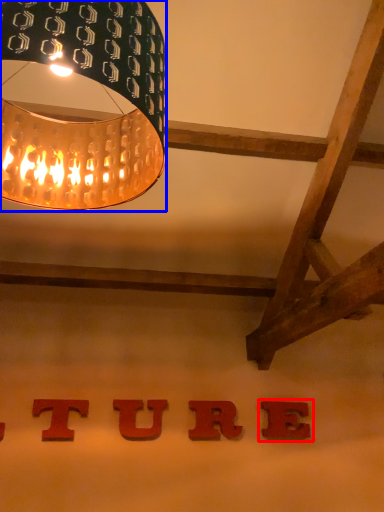
Question: Which of the following is the farthest to the observer, alphabet (highlighted by a red box) or lamp (highlighted by a blue box)?

Choices:
 (A) alphabet
 (B) lamp

Answer: (A)